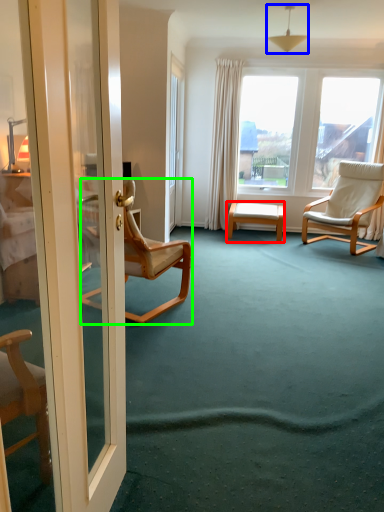
Question: Which object is positioned closest to table (highlighted by a red box)? Select from lamp (highlighted by a blue box) and chair (highlighted by a green box).

Choices:
 (A) lamp
 (B) chair

Answer: (B)